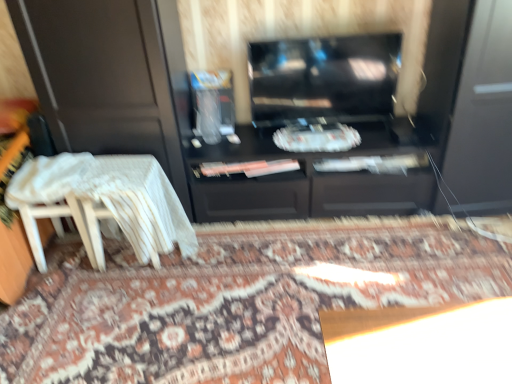
Image resolution: width=512 pixels, height=384 pixels. In order to click on free space above white lace table at lower left (from a real-world perspective) in this screenshot , I will do `click(112, 175)`.